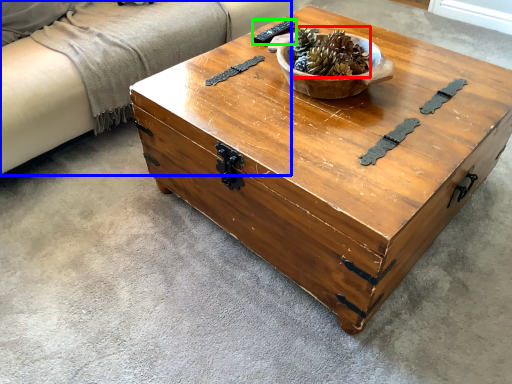
Question: Which object is the farthest from centerpiece (highlighted by a red box)? Choose among these: couch (highlighted by a blue box) or remote (highlighted by a green box).

Choices:
 (A) couch
 (B) remote

Answer: (A)